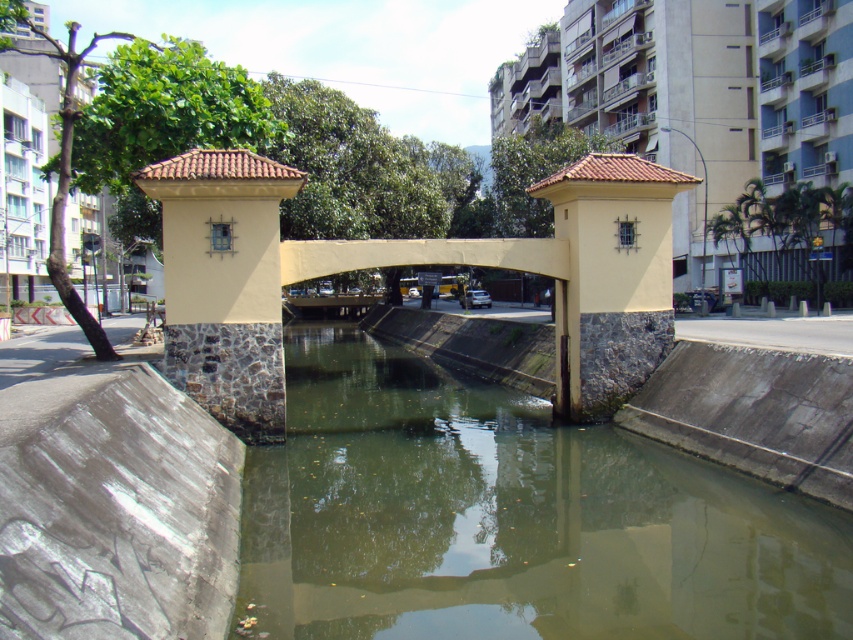
Question: Can you confirm if matte yellow stone bridge at center is bigger than yellow stone pillar at center?

Choices:
 (A) no
 (B) yes

Answer: (B)

Question: Based on their relative distances, which object is nearer to the greenish concrete water at center?

Choices:
 (A) yellow stone pillar at center
 (B) matte yellow stone bridge at center

Answer: (B)

Question: Which of these objects is positioned closest to the greenish concrete water at center?

Choices:
 (A) yellow stone pillar at center
 (B) matte yellow stone bridge at center

Answer: (B)

Question: Is greenish concrete water at center thinner than matte yellow stone bridge at center?

Choices:
 (A) no
 (B) yes

Answer: (B)

Question: Which object appears closest to the camera in this image?

Choices:
 (A) matte yellow stone bridge at center
 (B) yellow stone pillar at center

Answer: (B)

Question: Is matte yellow stone bridge at center smaller than yellow stone pillar at center?

Choices:
 (A) no
 (B) yes

Answer: (A)